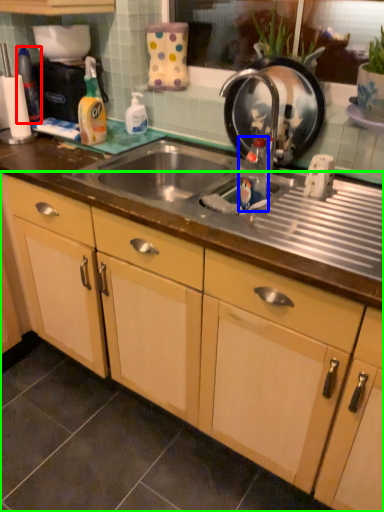
Question: Based on their relative distances, which object is nearer to bottle (highlighted by a red box)? Choose from bottle (highlighted by a blue box) and cabinetry (highlighted by a green box).

Choices:
 (A) bottle
 (B) cabinetry

Answer: (A)